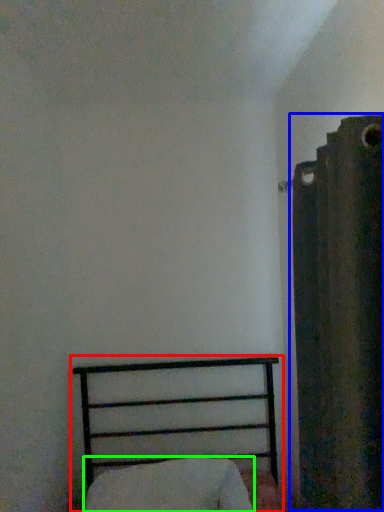
Question: Which object is the farthest from bed (highlighted by a red box)? Choose among these: curtain (highlighted by a blue box) or pillow (highlighted by a green box).

Choices:
 (A) curtain
 (B) pillow

Answer: (A)